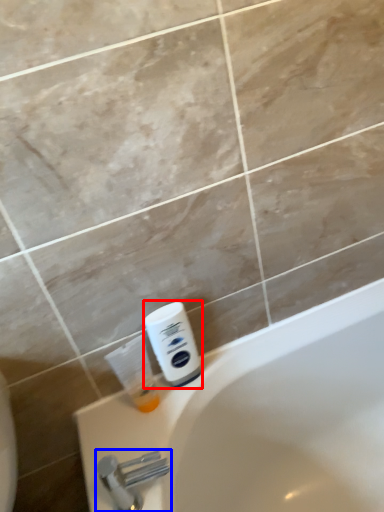
Question: Which object is further to the camera taking this photo, shaving cream (highlighted by a red box) or tap (highlighted by a blue box)?

Choices:
 (A) shaving cream
 (B) tap

Answer: (A)